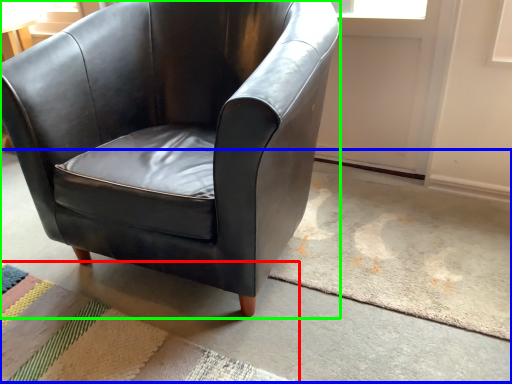
Question: Based on their relative distances, which object is farther from mat (highlighted by a red box)? Choose from concrete (highlighted by a blue box) and chair (highlighted by a green box).

Choices:
 (A) concrete
 (B) chair

Answer: (B)